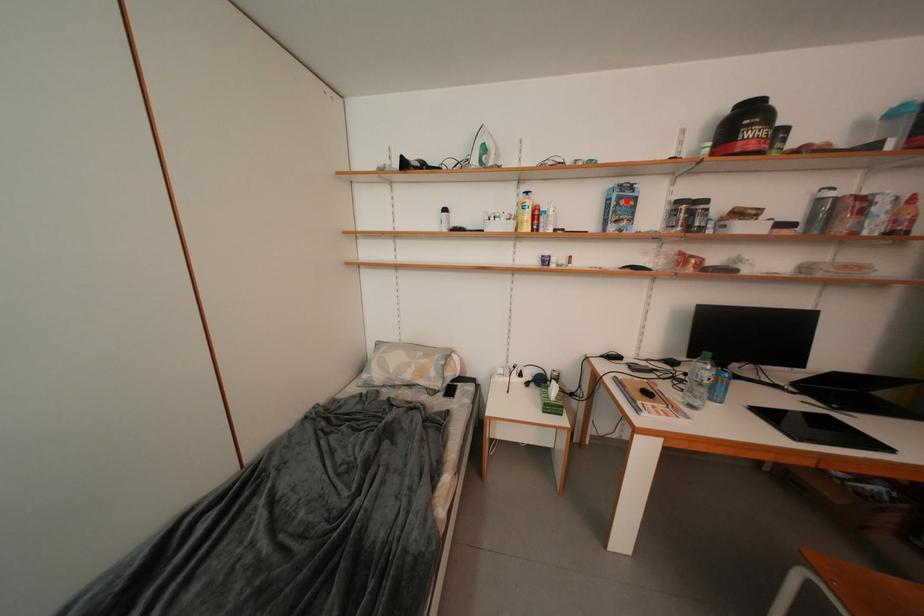
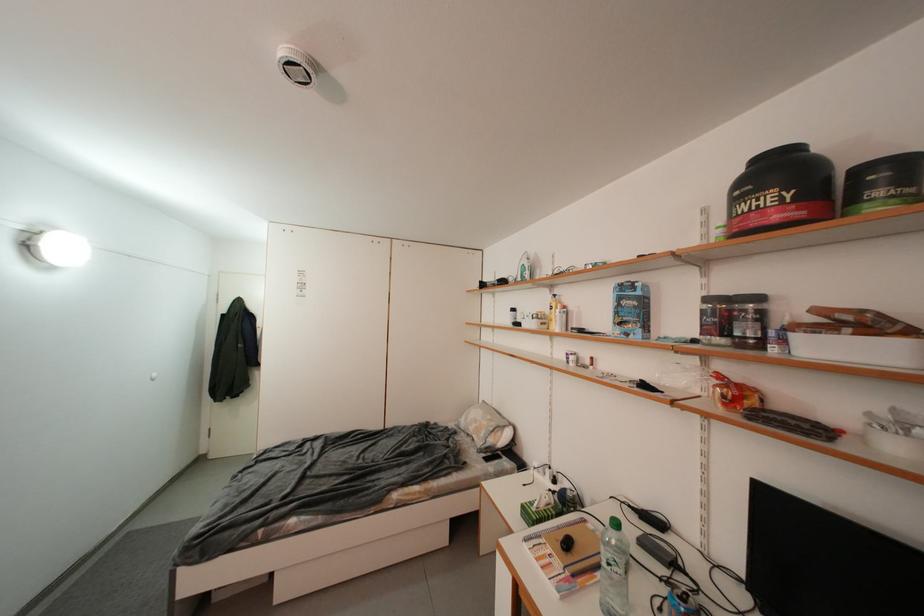
The point at the highlighted location is marked in the first image. Where is the corresponding point in the second image?

(627, 302)